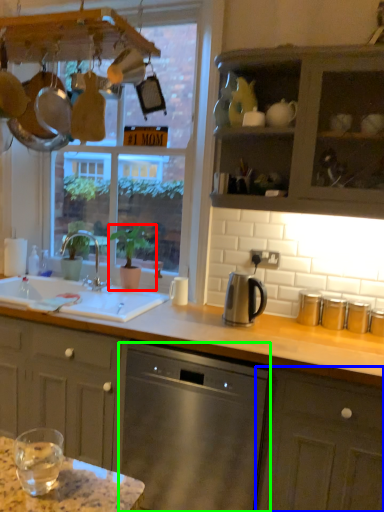
Question: Which object is the farthest from houseplant (highlighted by a red box)? Choose among these: cabinetry (highlighted by a blue box) or dishwasher (highlighted by a green box).

Choices:
 (A) cabinetry
 (B) dishwasher

Answer: (A)